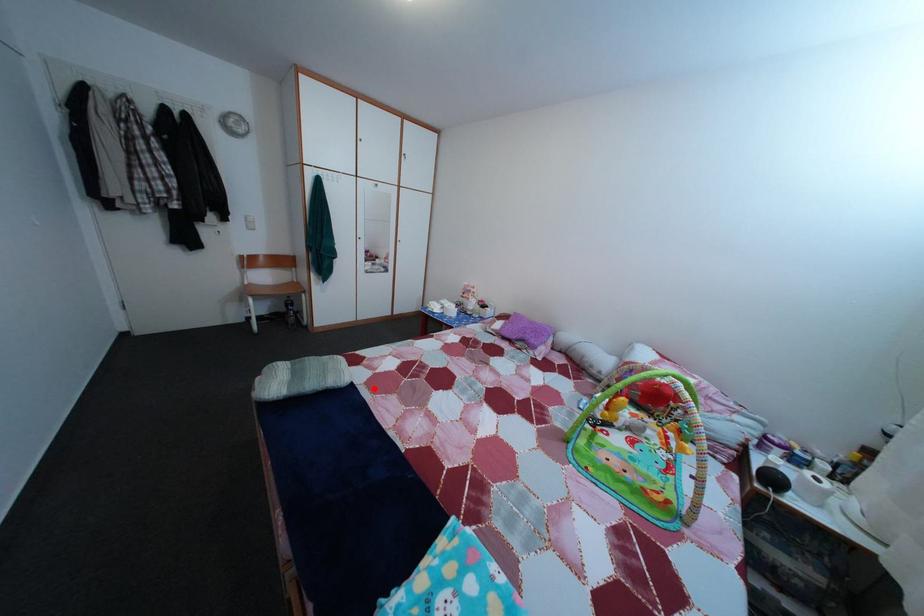
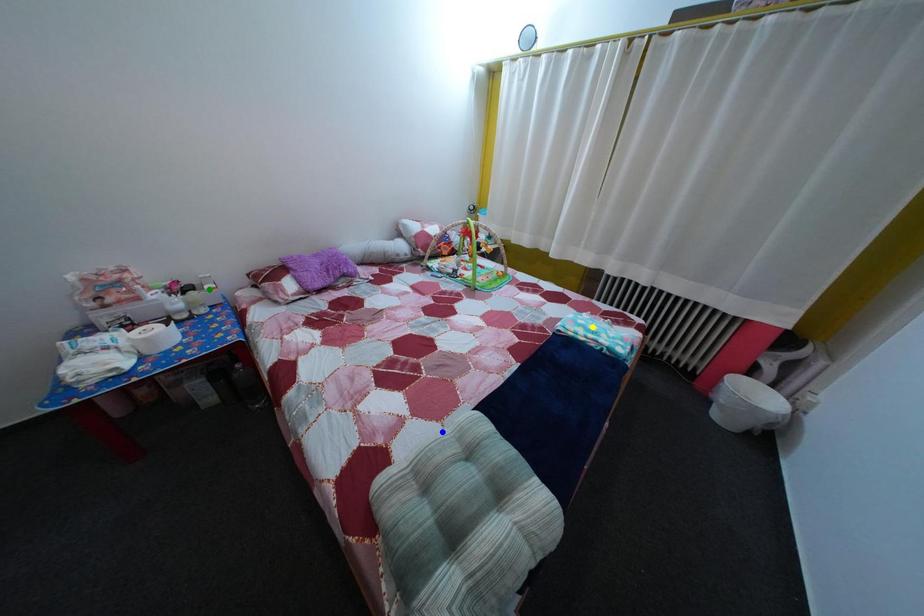
Question: I am providing you with two images of the same scene from different viewpoints. A red point is marked on the first image. You are given multiple points on the second image. In image 2, which mark is for the same physical point as the one in image 1?

Choices:
 (A) blue point
 (B) green point
 (C) yellow point

Answer: (A)